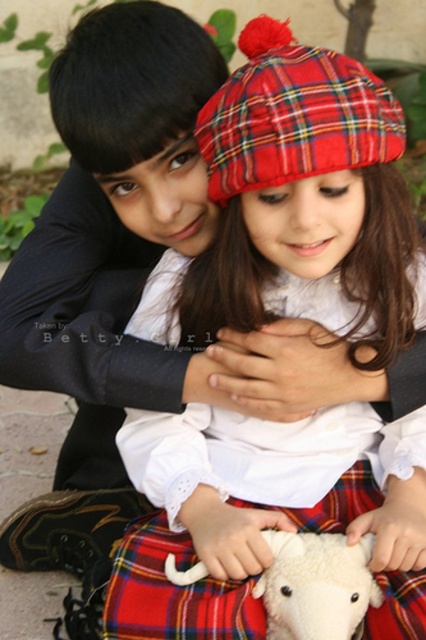
Which is below, red plaid kilt at lower center or white soft lamb at center?

Positioned lower is white soft lamb at center.

Can you confirm if red plaid kilt at lower center is thinner than white soft lamb at center?

Incorrect, red plaid kilt at lower center's width is not less than white soft lamb at center's.

At what (x,y) coordinates should I click in order to perform the action: click on red plaid kilt at lower center. Please return your answer as a coordinate pair (x, y). The image size is (426, 640). Looking at the image, I should click on pyautogui.click(x=173, y=593).

Does point (368, 458) come farther from viewer compared to point (370, 632)?

Yes.

The width and height of the screenshot is (426, 640). Describe the element at coordinates (298, 205) in the screenshot. I see `plaid fabric hat at upper center` at that location.

Between point (382, 461) and point (160, 598), which one is positioned behind?

The point (382, 461) is behind.

The image size is (426, 640). What are the coordinates of `plaid fabric hat at upper center` in the screenshot? It's located at (298, 205).

Does plaid fabric hat at upper center appear under white soft lamb at center?

No, plaid fabric hat at upper center is not below white soft lamb at center.

Can you confirm if plaid fabric hat at upper center is smaller than white soft lamb at center?

No, plaid fabric hat at upper center is not smaller than white soft lamb at center.

Which is behind, point (394, 433) or point (301, 609)?

The point (394, 433) is behind.

Where is `plaid fabric hat at upper center`? plaid fabric hat at upper center is located at coordinates point(298,205).